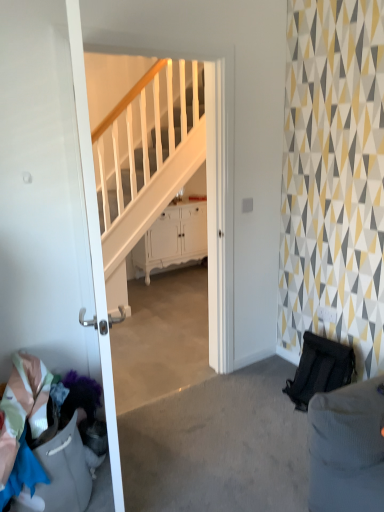
Question: Should I look upward or downward to see white glossy cabinet at center?

Choices:
 (A) up
 (B) down

Answer: (A)

Question: Is white glossy cabinet at center outside white glossy door at left?

Choices:
 (A) no
 (B) yes

Answer: (B)

Question: Is white glossy cabinet at center smaller than white glossy door at left?

Choices:
 (A) yes
 (B) no

Answer: (B)

Question: Is white glossy cabinet at center further to camera compared to white glossy door at left?

Choices:
 (A) yes
 (B) no

Answer: (A)

Question: From the image's perspective, is white glossy cabinet at center on white glossy door at left?

Choices:
 (A) yes
 (B) no

Answer: (A)

Question: Is white glossy door at left at the back of white glossy cabinet at center?

Choices:
 (A) no
 (B) yes

Answer: (A)

Question: Is white glossy cabinet at center wider than white glossy door at left?

Choices:
 (A) no
 (B) yes

Answer: (B)

Question: Could you tell me if multicolored fabric at lower left is facing white glossy cabinet at center?

Choices:
 (A) no
 (B) yes

Answer: (A)

Question: Is multicolored fabric at lower left surrounding white glossy cabinet at center?

Choices:
 (A) yes
 (B) no

Answer: (B)

Question: Does multicolored fabric at lower left have a smaller size compared to white glossy cabinet at center?

Choices:
 (A) yes
 (B) no

Answer: (A)

Question: Is multicolored fabric at lower left thinner than white glossy cabinet at center?

Choices:
 (A) yes
 (B) no

Answer: (B)

Question: Is the position of multicolored fabric at lower left less distant than that of white glossy cabinet at center?

Choices:
 (A) yes
 (B) no

Answer: (A)

Question: Does multicolored fabric at lower left appear on the left side of white glossy cabinet at center?

Choices:
 (A) yes
 (B) no

Answer: (A)

Question: From the image's perspective, is multicolored fabric at lower left under white glossy door at left?

Choices:
 (A) no
 (B) yes

Answer: (B)